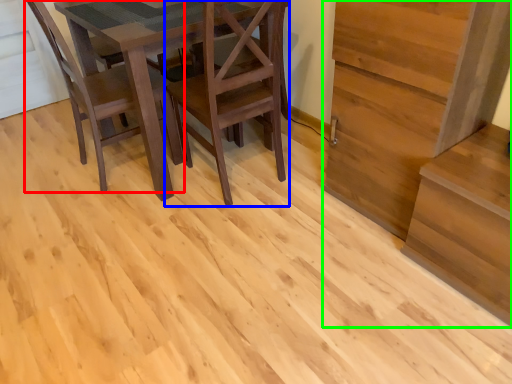
Question: Based on their relative distances, which object is farther from chair (highlighted by a red box)? Choose from chair (highlighted by a blue box) and stairwell (highlighted by a green box).

Choices:
 (A) chair
 (B) stairwell

Answer: (B)